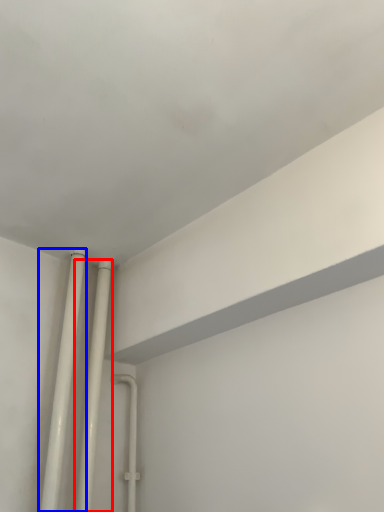
Question: Which object appears closest to the camera in this image, pipe (highlighted by a red box) or pipe (highlighted by a blue box)?

Choices:
 (A) pipe
 (B) pipe

Answer: (B)